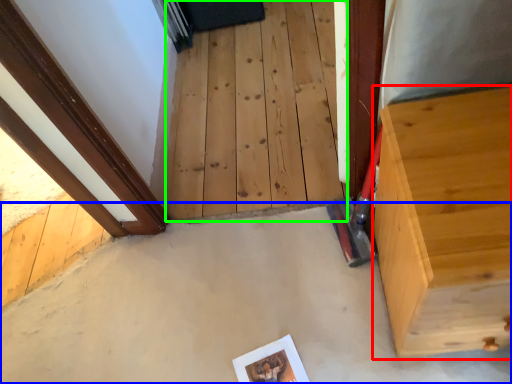
Question: Which object is the closest to the furniture (highlighted by a red box)? Choose among these: concrete (highlighted by a blue box) or stairwell (highlighted by a green box).

Choices:
 (A) concrete
 (B) stairwell

Answer: (A)